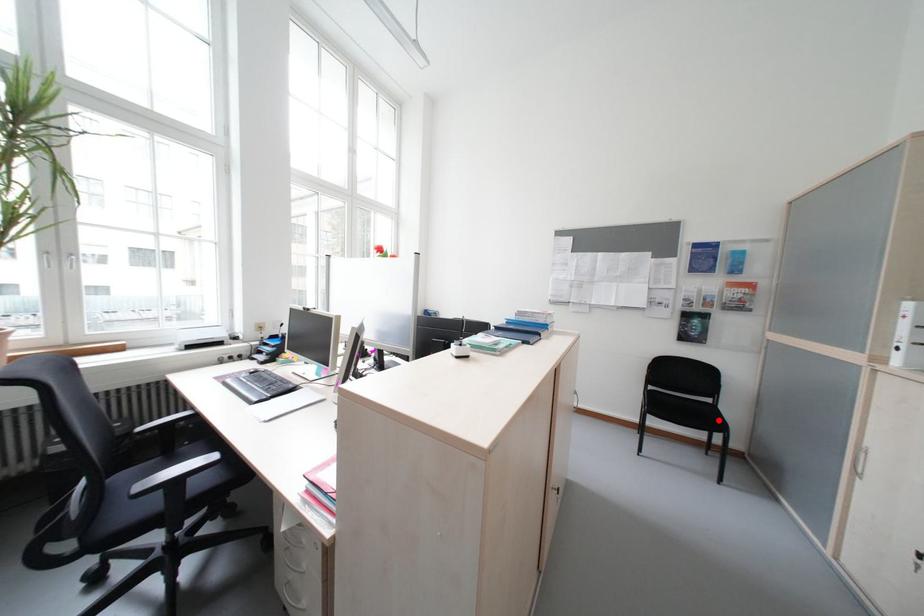
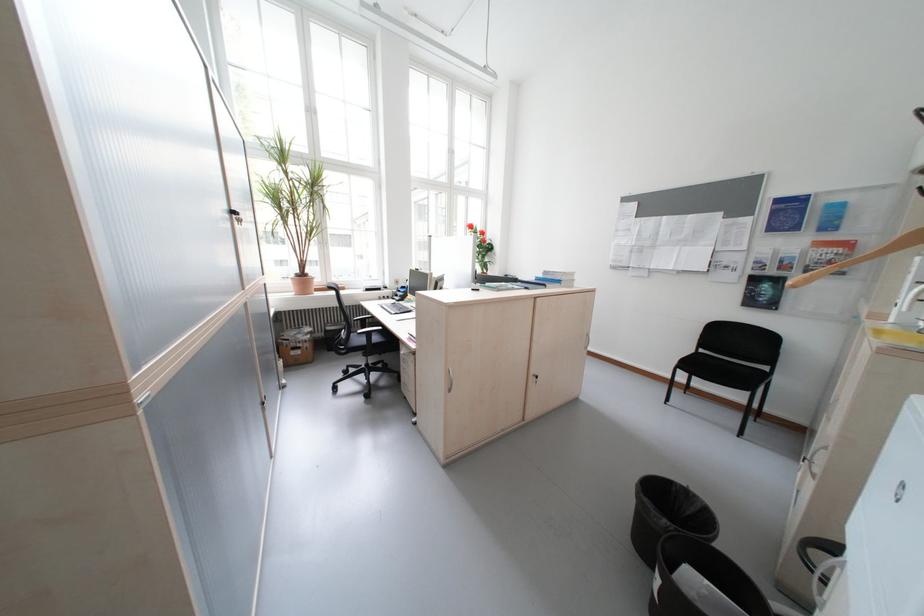
Find the pixel in the second image that matches the highlighted location in the first image.

(758, 382)